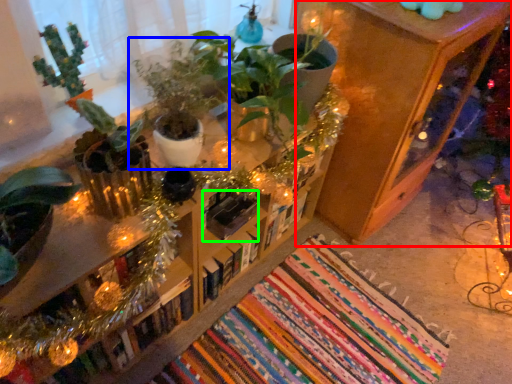
Question: Estimate the real-world distances between objects in this image. Which object is farther from shelf (highlighted by a red box), houseplant (highlighted by a blue box) or book (highlighted by a green box)?

Choices:
 (A) houseplant
 (B) book

Answer: (A)